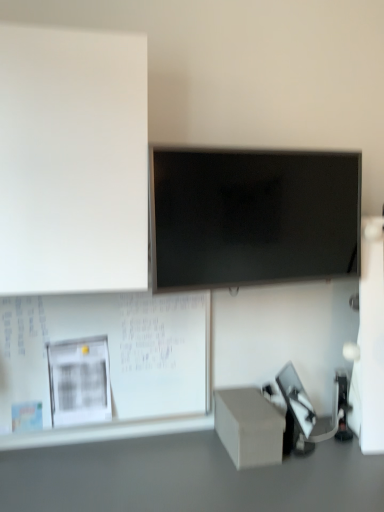
Question: Is matte gray cube at lower right in front of or behind smooth gray table at lower center in the image?

Choices:
 (A) front
 (B) behind

Answer: (B)

Question: Does point (256, 399) appear closer or farther from the camera than point (67, 492)?

Choices:
 (A) closer
 (B) farther

Answer: (B)

Question: Which object is positioned farthest from the matte gray cube at lower right?

Choices:
 (A) matte black screen at center
 (B) smooth gray table at lower center
 (C) white matte bulletin board at lower left, the 2th bulletin board when ordered from top to bottom
 (D) white matte board at upper left, marked as the second bulletin board in a bottom-to-top arrangement

Answer: (D)

Question: Which of these objects is positioned closest to the matte black screen at center?

Choices:
 (A) white matte bulletin board at lower left, arranged as the 1th bulletin board when ordered from the bottom
 (B) white matte board at upper left, positioned as the first bulletin board in top-to-bottom order
 (C) smooth gray table at lower center
 (D) matte gray cube at lower right

Answer: (B)